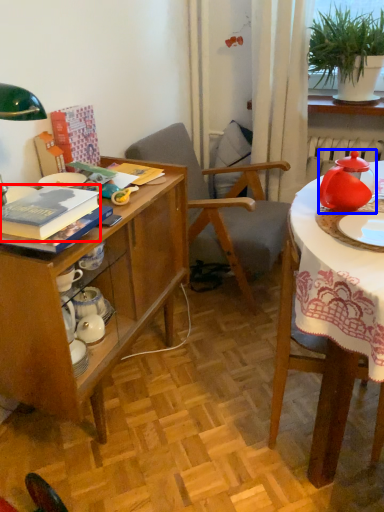
Question: Which object is further to the camera taking this photo, book (highlighted by a red box) or tableware (highlighted by a blue box)?

Choices:
 (A) book
 (B) tableware

Answer: (B)